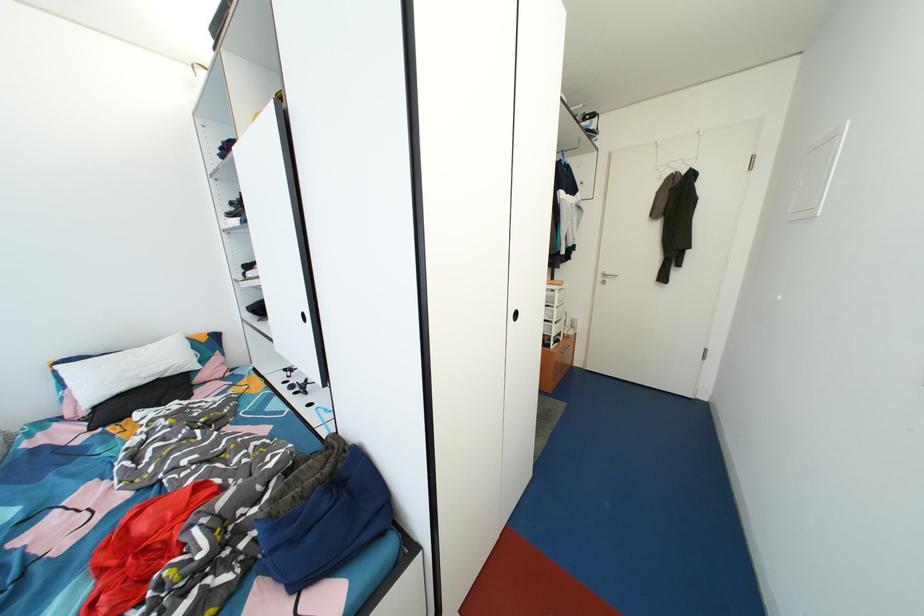
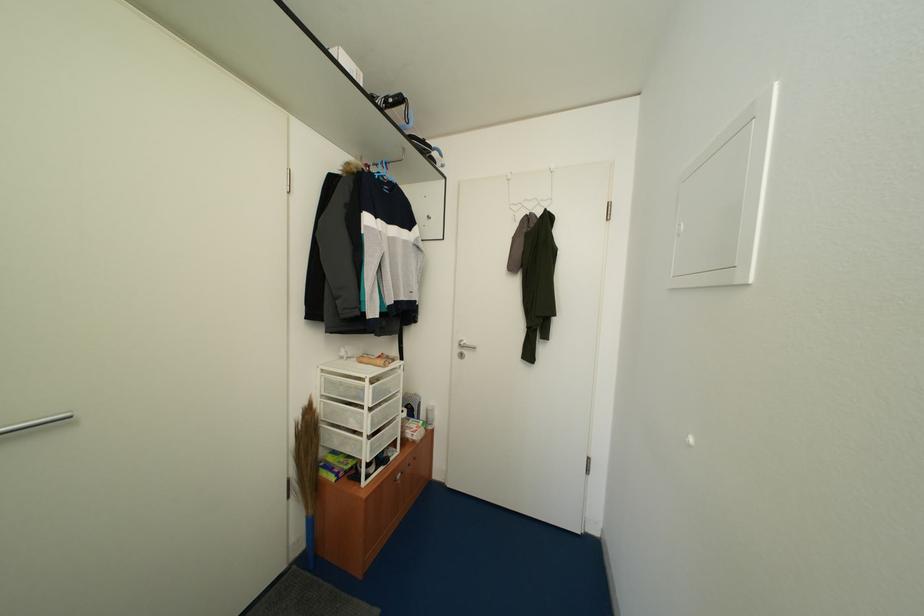
What movement of the cameraman would produce the second image?

The movement direction of the cameraman is right, forward.